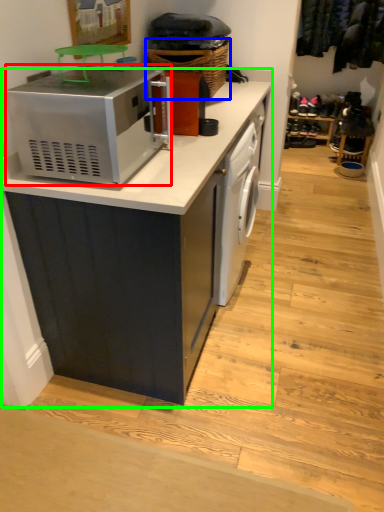
Question: Estimate the real-world distances between objects in this image. Which object is closer to home appliance (highlighted by a red box), basket (highlighted by a blue box) or cabinetry (highlighted by a green box)?

Choices:
 (A) basket
 (B) cabinetry

Answer: (B)